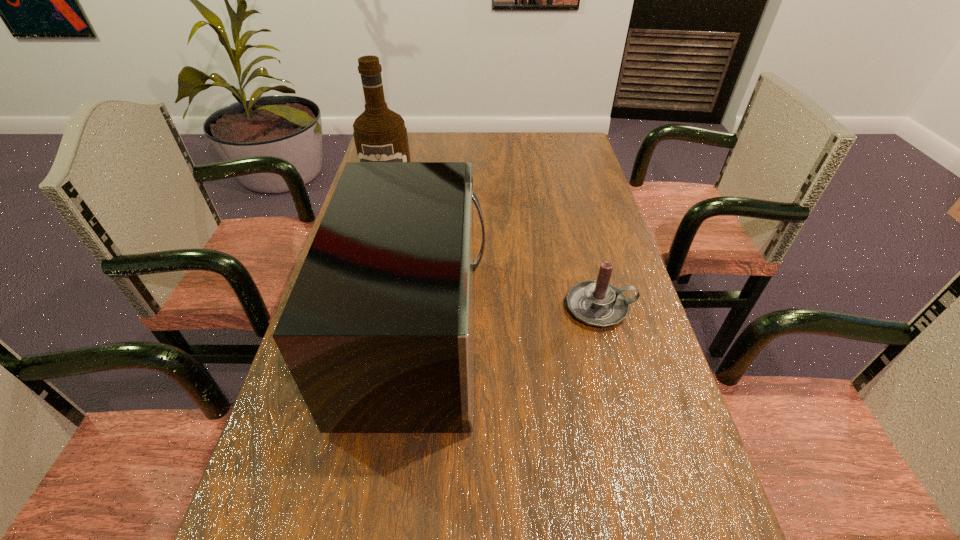
What are the coordinates of `object that can be found as the second closest to the second shortest object` in the screenshot? It's located at (380, 135).

I want to click on the closest object to the microwave oven, so click(597, 303).